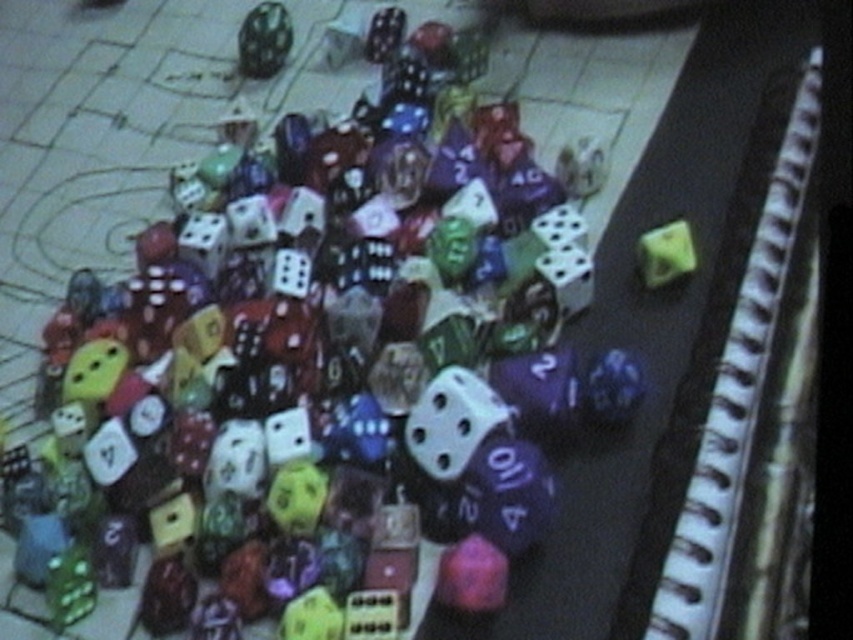
You are organizing dice on a shelf and need to place the matte black dice at upper center and the matte green die at upper right. Which one requires a wider space on the shelf?

The matte black dice at upper center requires a wider space on the shelf because its width is larger than the matte green die at upper right.

You are a game designer trying to arrange two dice on a table for a promotional photo. You have the matte black dice at upper center and the matte green die at upper right. If you want to place them exactly 24 inches apart, will you need to move them closer or farther apart?

The current distance between the matte black dice at upper center and the matte green die at upper right is 21.33 inches. To reach 24 inches, you need to move them farther apart.